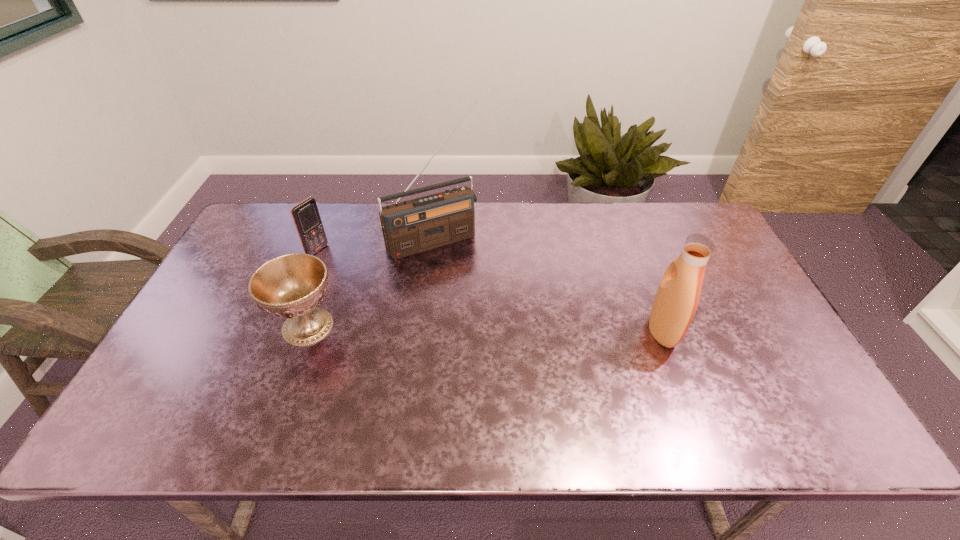
What are the coordinates of `free space on the desktop that is between the chalice and the rightmost object and is positioned on the front-facing side of the tallest object` in the screenshot? It's located at (487, 329).

The width and height of the screenshot is (960, 540). What are the coordinates of `vacant space on the desktop that is between the chalice and the second tallest object and is positioned on the screen of the cellular telephone` in the screenshot? It's located at (472, 328).